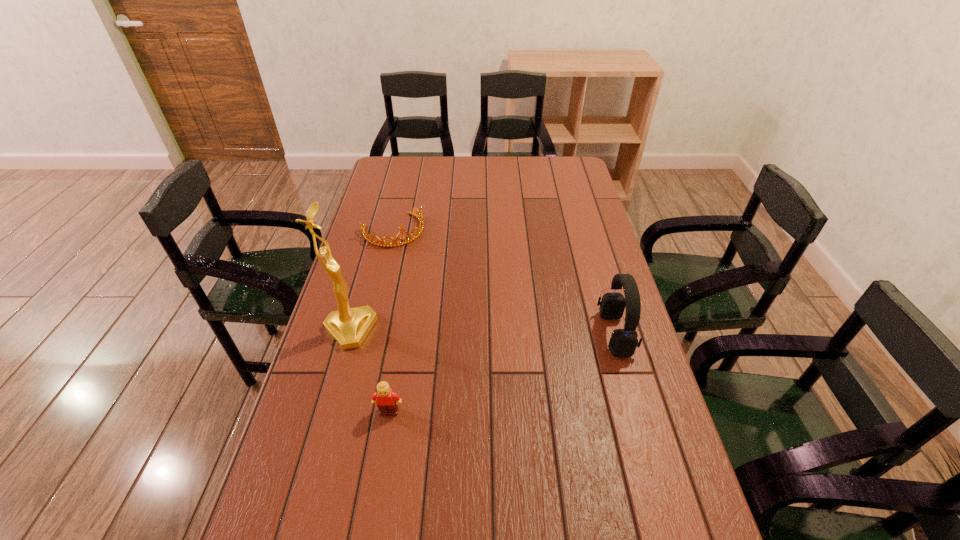
Locate an element on the screen. The height and width of the screenshot is (540, 960). free space that is in between the tiara and the Lego is located at coordinates (391, 321).

You are a GUI agent. You are given a task and a screenshot of the screen. Output one action in this format:
    pyautogui.click(x=<x>, y=<y>)
    Task: Click on the vacant point located between the second tallest object and the award
    The image size is (960, 540).
    Given the screenshot: What is the action you would take?
    pyautogui.click(x=482, y=332)

Where is `vacant space that is in between the rightmost object and the second shortest object`? This screenshot has height=540, width=960. vacant space that is in between the rightmost object and the second shortest object is located at coordinates pyautogui.click(x=502, y=373).

You are a GUI agent. You are given a task and a screenshot of the screen. Output one action in this format:
    pyautogui.click(x=<x>, y=<y>)
    Task: Click on the free space between the tiara and the third shortest object
    This screenshot has width=960, height=540.
    Given the screenshot: What is the action you would take?
    pyautogui.click(x=504, y=282)

At what (x,y) coordinates should I click in order to perform the action: click on vacant space that is in between the Lego and the award. Please return your answer as a coordinate pair (x, y). The image size is (960, 540). Looking at the image, I should click on (370, 371).

Where is `object that is the closest one to the award`? The width and height of the screenshot is (960, 540). object that is the closest one to the award is located at coordinates (387, 400).

Identify which object is the closest to the farthest object. Please provide its 2D coordinates. Your answer should be formatted as a tuple, i.e. [(x, y)], where the tuple contains the x and y coordinates of a point satisfying the conditions above.

[(348, 326)]

Locate an element on the screen. The image size is (960, 540). vacant region that satisfies the following two spatial constraints: 1. on the front side of the headset; 2. on the headband of the tallest object is located at coordinates (348, 334).

Where is `blank area in the image that satisfies the following two spatial constraints: 1. on the front side of the rightmost object; 2. on the headband of the farthest object`? blank area in the image that satisfies the following two spatial constraints: 1. on the front side of the rightmost object; 2. on the headband of the farthest object is located at coordinates (369, 334).